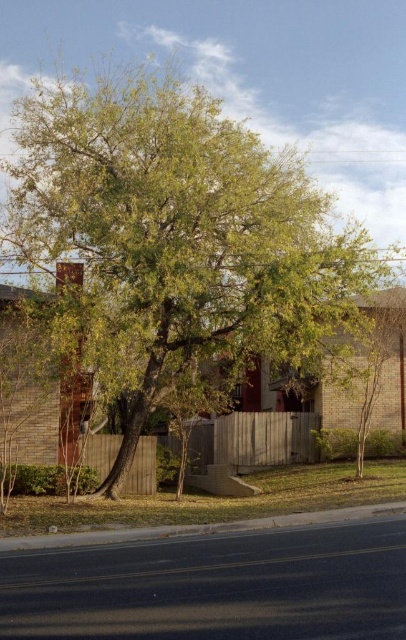
Is green leafy tree at center taller than wooden fence at center?

Yes, green leafy tree at center is taller than wooden fence at center.

Is point (317, 301) positioned after point (285, 435)?

No, (317, 301) is closer to viewer.

This screenshot has width=406, height=640. I want to click on green leafy tree at center, so click(177, 228).